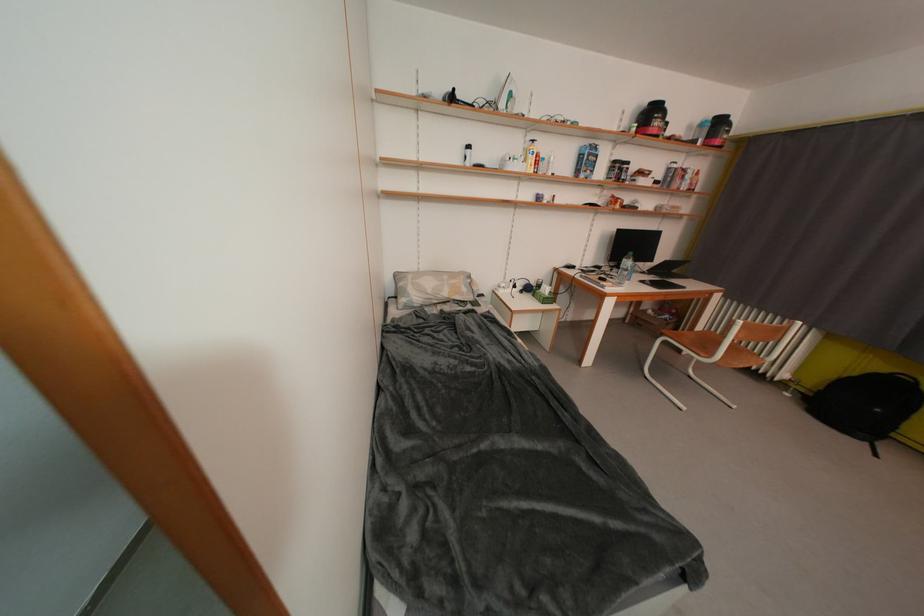
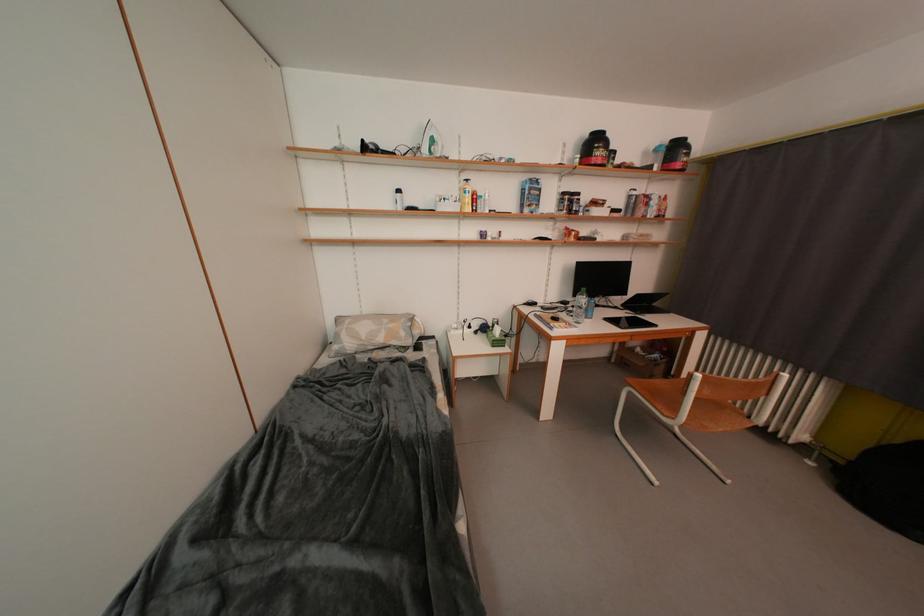
Question: The first image is from the beginning of the video and the second image is from the end. How did the camera likely rotate when shooting the video?

Choices:
 (A) Left
 (B) Right
 (C) Up
 (D) Down

Answer: (C)